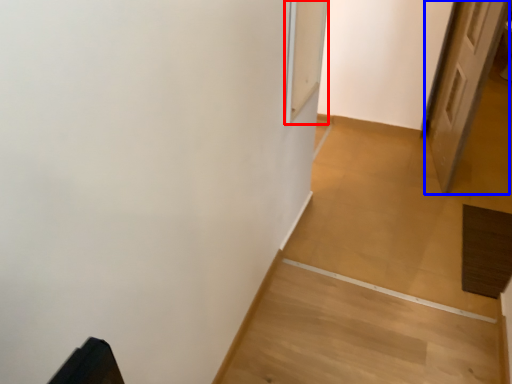
Question: Which object appears closest to the camera in this image, screen door (highlighted by a red box) or door (highlighted by a blue box)?

Choices:
 (A) screen door
 (B) door

Answer: (A)